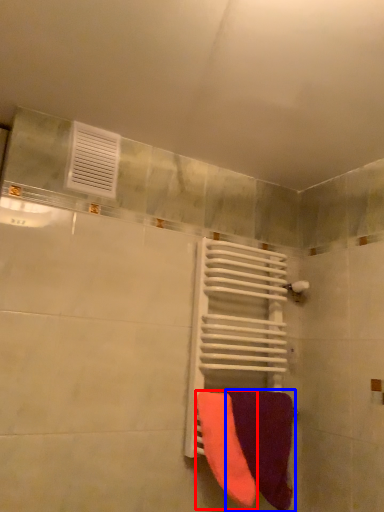
Question: Which object appears closest to the camera in this image, towel (highlighted by a red box) or towel (highlighted by a blue box)?

Choices:
 (A) towel
 (B) towel

Answer: (A)